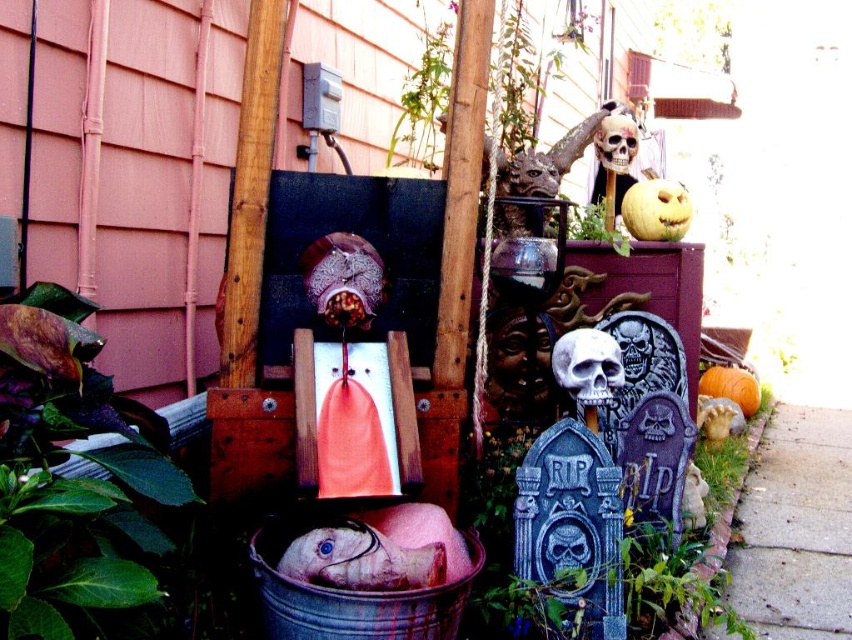
You are a visitor at this Halloween display and want to take a photo of both the white matte skull at center and the matte plastic skull at upper right. Which one should you focus on first to ensure both are in the frame?

You should focus on the white matte skull at center first because it is located below the matte plastic skull at upper right, so adjusting the camera angle to include both would require framing from the lower to upper positions.

You are a delivery person who needs to place a package between the white matte skull at center and the orange matte pumpkin at lower right. The package requires 1.5 meters of space. Is there enough space between them?

The white matte skull at center is 1.64 meters from orange matte pumpkin at lower right, so yes, there is enough space between them to place the package as it exceeds the required 1.5 meters.